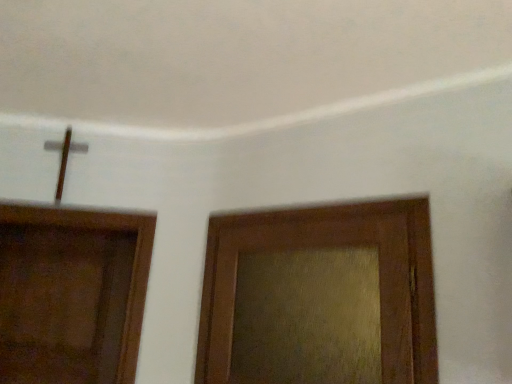
The image size is (512, 384). Find the location of `brown wooden door at left, positioned as the 2th door in right-to-left order`. brown wooden door at left, positioned as the 2th door in right-to-left order is located at coordinates (62, 304).

The width and height of the screenshot is (512, 384). What do you see at coordinates (62, 304) in the screenshot?
I see `brown wooden door at left, placed as the first door when sorted from left to right` at bounding box center [62, 304].

This screenshot has width=512, height=384. What are the coordinates of `wooden textured door at right, which ranks as the 1th door in front-to-back order` in the screenshot? It's located at (331, 246).

This screenshot has height=384, width=512. What do you see at coordinates (331, 246) in the screenshot?
I see `wooden textured door at right, placed as the 1th door when sorted from right to left` at bounding box center [331, 246].

In order to face wooden textured door at right, which ranks as the 1th door in front-to-back order, should I rotate leftwards or rightwards?

A 6.036 degree turn to the right will do.

At what (x,y) coordinates should I click in order to perform the action: click on brown wooden door at left, which is counted as the 1th door, starting from the back. Please return your answer as a coordinate pair (x, y). Looking at the image, I should click on (62, 304).

Which is more to the right, wooden textured door at right, placed as the 1th door when sorted from right to left, or brown wooden door at left, which ranks as the 2th door in front-to-back order?

From the viewer's perspective, wooden textured door at right, placed as the 1th door when sorted from right to left, appears more on the right side.

Is wooden textured door at right, the 2th door positioned from the left, further to the viewer compared to brown wooden door at left, positioned as the 2th door in right-to-left order?

No, wooden textured door at right, the 2th door positioned from the left, is closer to the camera.

Is point (373, 231) positioned behind point (13, 242)?

No, it is in front of (13, 242).

From the image's perspective, is wooden textured door at right, the 2th door positioned from the left, on top of brown wooden door at left, placed as the first door when sorted from left to right?

Yes.

From a real-world perspective, relative to brown wooden door at left, which is counted as the 1th door, starting from the back, is wooden textured door at right, placed as the second door when sorted from back to front, vertically above or below?

wooden textured door at right, placed as the second door when sorted from back to front, is above brown wooden door at left, which is counted as the 1th door, starting from the back.

Considering the sizes of objects wooden textured door at right, the 2th door positioned from the left, and brown wooden door at left, which is counted as the 1th door, starting from the back, in the image provided, who is thinner, wooden textured door at right, the 2th door positioned from the left, or brown wooden door at left, which is counted as the 1th door, starting from the back,?

wooden textured door at right, the 2th door positioned from the left, is thinner.

Does wooden textured door at right, placed as the 1th door when sorted from right to left, have a greater height compared to brown wooden door at left, which ranks as the 2th door in front-to-back order?

Incorrect, the height of wooden textured door at right, placed as the 1th door when sorted from right to left, is not larger of that of brown wooden door at left, which ranks as the 2th door in front-to-back order.

Is wooden textured door at right, placed as the second door when sorted from back to front, smaller than brown wooden door at left, which is counted as the 1th door, starting from the back?

Indeed, wooden textured door at right, placed as the second door when sorted from back to front, has a smaller size compared to brown wooden door at left, which is counted as the 1th door, starting from the back.

Is wooden textured door at right, placed as the second door when sorted from back to front, not within brown wooden door at left, which is counted as the 1th door, starting from the back?

Yes.

Can you see wooden textured door at right, placed as the 1th door when sorted from right to left, touching brown wooden door at left, positioned as the 2th door in right-to-left order?

wooden textured door at right, placed as the 1th door when sorted from right to left, and brown wooden door at left, positioned as the 2th door in right-to-left order, are clearly separated.

Is wooden textured door at right, placed as the second door when sorted from back to front, facing away from brown wooden door at left, placed as the first door when sorted from left to right?

wooden textured door at right, placed as the second door when sorted from back to front, does not have its back to brown wooden door at left, placed as the first door when sorted from left to right.

Looking at this image, what's the angular difference between wooden textured door at right, placed as the second door when sorted from back to front, and brown wooden door at left, which is counted as the 1th door, starting from the back,'s facing directions?

The angle between the facing direction of wooden textured door at right, placed as the second door when sorted from back to front, and the facing direction of brown wooden door at left, which is counted as the 1th door, starting from the back, is 39 degrees.

How much distance is there between wooden textured door at right, placed as the 1th door when sorted from right to left, and brown wooden door at left, which ranks as the 2th door in front-to-back order?

wooden textured door at right, placed as the 1th door when sorted from right to left, and brown wooden door at left, which ranks as the 2th door in front-to-back order, are 35.40 inches apart.

Where is `door beneath the wooden textured door at right, which ranks as the 1th door in front-to-back order (from a real-world perspective)`? This screenshot has width=512, height=384. door beneath the wooden textured door at right, which ranks as the 1th door in front-to-back order (from a real-world perspective) is located at coordinates (62, 304).

Based on their positions, is brown wooden door at left, placed as the first door when sorted from left to right, located to the left or right of wooden textured door at right, the 2th door positioned from the left?

In the image, brown wooden door at left, placed as the first door when sorted from left to right, appears on the left side of wooden textured door at right, the 2th door positioned from the left.

Which is in front, brown wooden door at left, which is counted as the 1th door, starting from the back, or wooden textured door at right, which ranks as the 1th door in front-to-back order?

wooden textured door at right, which ranks as the 1th door in front-to-back order, is in front.

Is point (93, 346) closer or farther from the camera than point (225, 286)?

Clearly, point (93, 346) is more distant from the camera than point (225, 286).

From the image's perspective, is brown wooden door at left, placed as the first door when sorted from left to right, positioned above or below wooden textured door at right, placed as the 1th door when sorted from right to left?

Clearly, from the image's perspective, brown wooden door at left, placed as the first door when sorted from left to right, is below wooden textured door at right, placed as the 1th door when sorted from right to left.

From a real-world perspective, is brown wooden door at left, which ranks as the 2th door in front-to-back order, located higher than wooden textured door at right, the 2th door positioned from the left?

No.

Is brown wooden door at left, positioned as the 2th door in right-to-left order, thinner than wooden textured door at right, which ranks as the 1th door in front-to-back order?

Incorrect, the width of brown wooden door at left, positioned as the 2th door in right-to-left order, is not less than that of wooden textured door at right, which ranks as the 1th door in front-to-back order.

Is brown wooden door at left, positioned as the 2th door in right-to-left order, taller than wooden textured door at right, placed as the second door when sorted from back to front?

Yes.

Can you confirm if brown wooden door at left, positioned as the 2th door in right-to-left order, is bigger than wooden textured door at right, which ranks as the 1th door in front-to-back order?

Yes.

Is brown wooden door at left, positioned as the 2th door in right-to-left order, inside the boundaries of wooden textured door at right, placed as the second door when sorted from back to front, or outside?

brown wooden door at left, positioned as the 2th door in right-to-left order, is spatially situated outside wooden textured door at right, placed as the second door when sorted from back to front.

Is brown wooden door at left, which is counted as the 1th door, starting from the back, far from wooden textured door at right, placed as the 1th door when sorted from right to left?

Actually, brown wooden door at left, which is counted as the 1th door, starting from the back, and wooden textured door at right, placed as the 1th door when sorted from right to left, are a little close together.

Does brown wooden door at left, which ranks as the 2th door in front-to-back order, turn towards wooden textured door at right, the 2th door positioned from the left?

No, brown wooden door at left, which ranks as the 2th door in front-to-back order, is not aimed at wooden textured door at right, the 2th door positioned from the left.

In the scene shown: How far apart are brown wooden door at left, placed as the first door when sorted from left to right, and wooden textured door at right, placed as the second door when sorted from back to front?

brown wooden door at left, placed as the first door when sorted from left to right, and wooden textured door at right, placed as the second door when sorted from back to front, are 35.40 inches apart.

In the image, there is a brown wooden door at left, placed as the first door when sorted from left to right. Where is `door above it (from the image's perspective)`? This screenshot has width=512, height=384. door above it (from the image's perspective) is located at coordinates click(x=331, y=246).

Find the location of a particular element. The height and width of the screenshot is (384, 512). door that appears above the brown wooden door at left, placed as the first door when sorted from left to right (from a real-world perspective) is located at coordinates (331, 246).

This screenshot has height=384, width=512. In order to click on door on the right of brown wooden door at left, which is counted as the 1th door, starting from the back in this screenshot , I will do `click(331, 246)`.